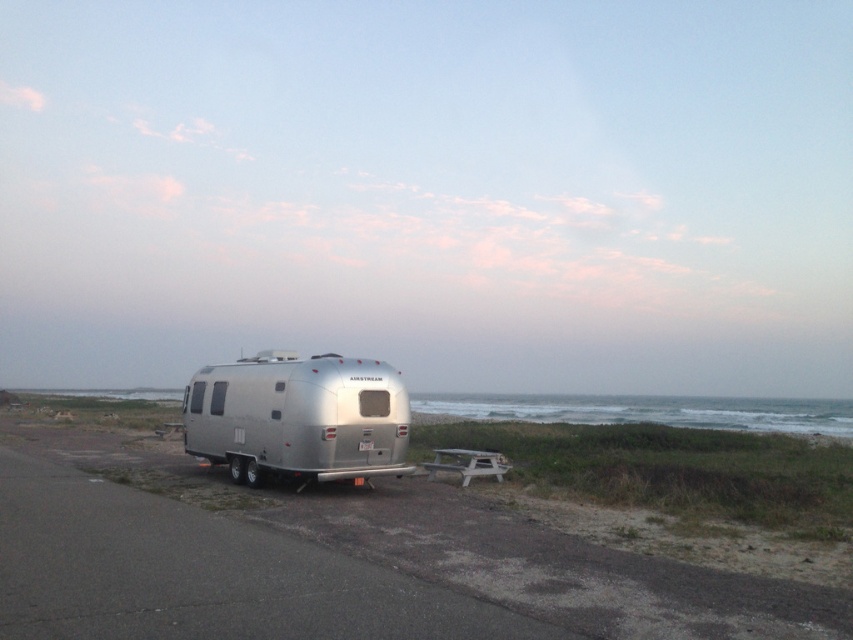
You are planning to park your car in the parking lot where the silver metallic trailer at center and the silver metallic airstream trailer at center are already parked. Which trailer takes up more space in the parking lot?

The silver metallic airstream trailer at center takes up more space than the silver metallic trailer at center in the parking lot.

You are planning to park your 10 foot long car behind the silver metallic trailer at center and the silver metallic airstream trailer at center. Which trailer should you park behind to ensure enough space for your car?

The silver metallic airstream trailer at center is taller than the silver metallic trailer at center, so you should park behind the silver metallic airstream trailer at center to have enough space for your 10 foot long car.